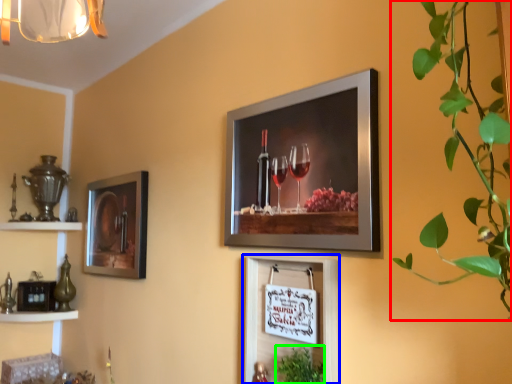
Question: Considering the real-world distances, which object is closest to houseplant (highlighted by a red box)? picture frame (highlighted by a blue box) or plant (highlighted by a green box).

Choices:
 (A) picture frame
 (B) plant

Answer: (A)